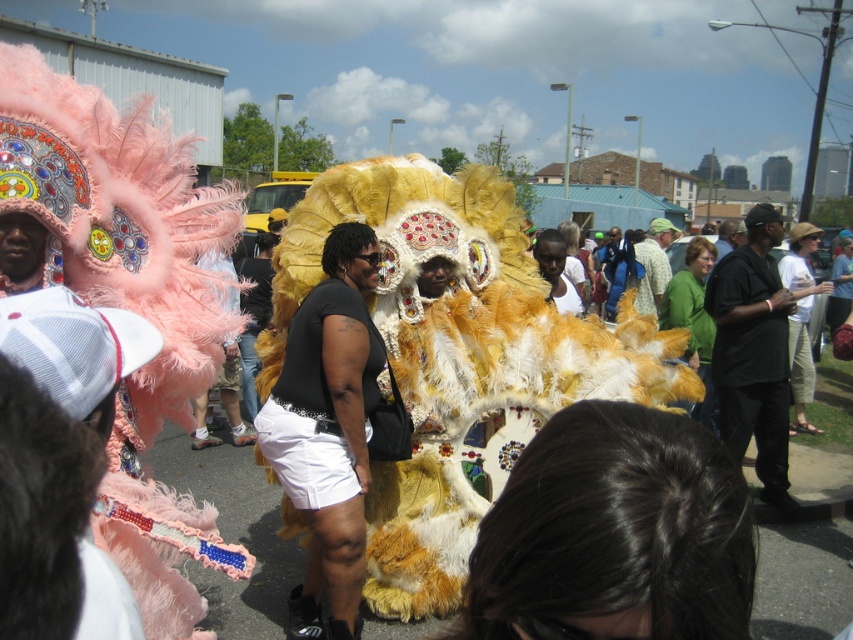
Looking at this image, you are a photographer at the parade trying to capture both the fuzzy yellow costume at center and the white matte shirt at center in a single frame. Which costume should you focus on to ensure both are in the frame without moving the camera?

You should focus on the fuzzy yellow costume at center because it is bigger than the white matte shirt at center, so centering on it will naturally include the smaller white matte shirt at center in the frame.

You are a photographer standing at the edge of the crowd, trying to capture a photo of both the black mesh tank top at center and the white cotton pants at center in the same frame. Given that your camera has a maximum focus range of 5 meters, will you be able to capture both items in focus without moving closer?

The black mesh tank top at center and white cotton pants at center are 5.66 meters apart from each other. Since the distance between them exceeds the camera maximum focus range of 5 meters, you cannot capture both items in focus without moving closer.